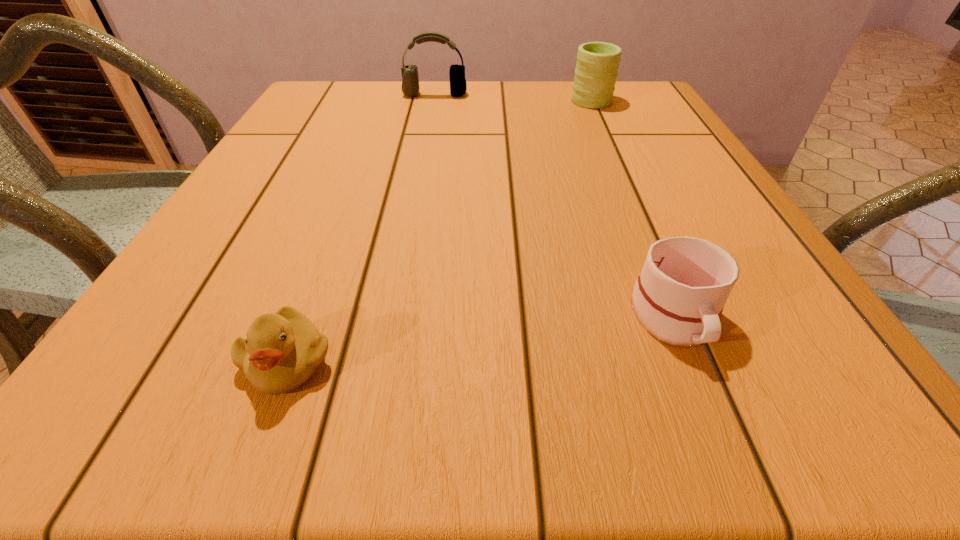
This screenshot has width=960, height=540. In order to click on free space that is in between the duckling and the headset in this screenshot , I will do `click(362, 228)`.

Where is `empty space that is in between the tallest object and the duckling`? This screenshot has width=960, height=540. empty space that is in between the tallest object and the duckling is located at coordinates (362, 228).

Locate an element on the screen. This screenshot has width=960, height=540. object that is the nearest to the nearer mug is located at coordinates (281, 351).

This screenshot has width=960, height=540. Find the location of `object that can be found as the third closest to the nearer mug`. object that can be found as the third closest to the nearer mug is located at coordinates (410, 82).